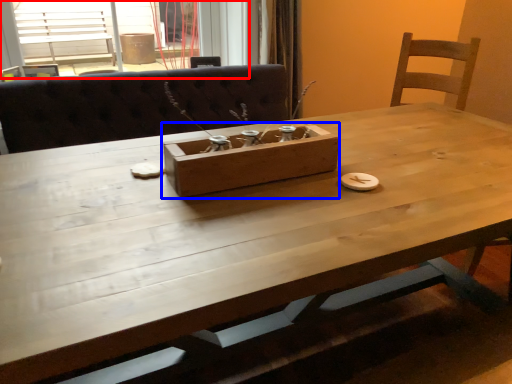
Question: Which object appears farthest to the camera in this image, window (highlighted by a red box) or cardboard box (highlighted by a blue box)?

Choices:
 (A) window
 (B) cardboard box

Answer: (A)